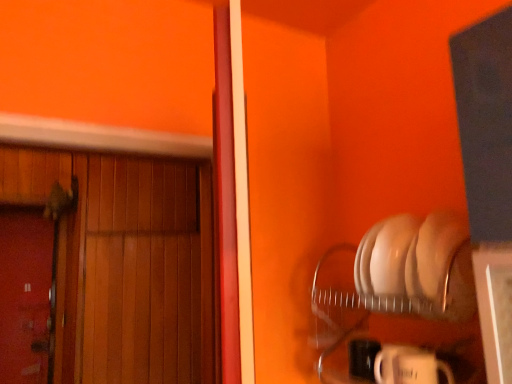
Question: Is smooth wooden door at left, the first door positioned from the left, at the back of wooden door at left, which appears as the second door when viewed from the left?

Choices:
 (A) no
 (B) yes

Answer: (A)

Question: Considering the relative sizes of wooden door at left, marked as the 1th door in a right-to-left arrangement, and smooth wooden door at left, acting as the second door starting from the right, in the image provided, is wooden door at left, marked as the 1th door in a right-to-left arrangement, shorter than smooth wooden door at left, acting as the second door starting from the right,?

Choices:
 (A) yes
 (B) no

Answer: (B)

Question: Does wooden door at left, marked as the 1th door in a right-to-left arrangement, have a larger size compared to smooth wooden door at left, the first door positioned from the left?

Choices:
 (A) yes
 (B) no

Answer: (A)

Question: Is wooden door at left, which appears as the second door when viewed from the left, outside smooth wooden door at left, acting as the second door starting from the right?

Choices:
 (A) no
 (B) yes

Answer: (B)

Question: Does wooden door at left, which appears as the second door when viewed from the left, have a greater height compared to smooth wooden door at left, the first door positioned from the left?

Choices:
 (A) yes
 (B) no

Answer: (A)

Question: Does wooden door at left, marked as the 1th door in a right-to-left arrangement, have a greater width compared to smooth wooden door at left, the first door positioned from the left?

Choices:
 (A) no
 (B) yes

Answer: (B)

Question: Is smooth wooden door at left, the first door positioned from the left, at the right side of wooden door at left, marked as the 1th door in a right-to-left arrangement?

Choices:
 (A) yes
 (B) no

Answer: (B)

Question: Is smooth wooden door at left, acting as the second door starting from the right, next to wooden door at left, marked as the 1th door in a right-to-left arrangement, and touching it?

Choices:
 (A) yes
 (B) no

Answer: (B)

Question: Could you tell me if smooth wooden door at left, the first door positioned from the left, is turned towards wooden door at left, marked as the 1th door in a right-to-left arrangement?

Choices:
 (A) no
 (B) yes

Answer: (A)

Question: Does smooth wooden door at left, the first door positioned from the left, have a greater width compared to wooden door at left, which appears as the second door when viewed from the left?

Choices:
 (A) yes
 (B) no

Answer: (B)

Question: Can you confirm if smooth wooden door at left, the first door positioned from the left, is shorter than wooden door at left, marked as the 1th door in a right-to-left arrangement?

Choices:
 (A) yes
 (B) no

Answer: (A)

Question: Is smooth wooden door at left, acting as the second door starting from the right, to the left of wooden door at left, which appears as the second door when viewed from the left, from the viewer's perspective?

Choices:
 (A) no
 (B) yes

Answer: (B)

Question: From a real-world perspective, is smooth wooden door at left, the first door positioned from the left, above or below wooden door at left, marked as the 1th door in a right-to-left arrangement?

Choices:
 (A) below
 (B) above

Answer: (A)